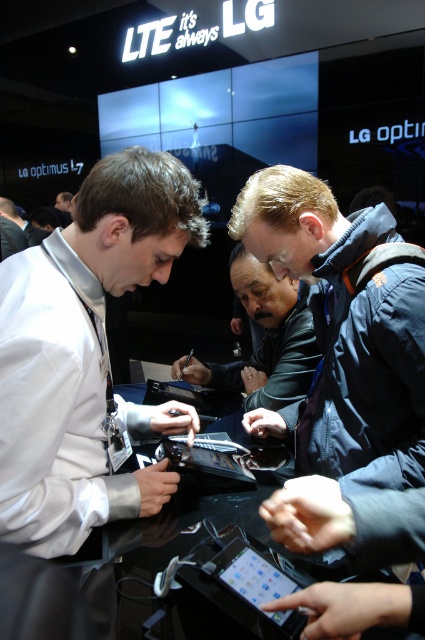
In the scene shown: You are an event photographer at the LG tech exhibition. You need to capture a photo of the white glossy shirt at left and the black leather jacket at center. Based on their sizes, which one should you focus on first to ensure proper framing?

The white glossy shirt at left has a lesser width compared to the black leather jacket at center, so you should focus on the black leather jacket at center first to ensure proper framing since it is wider and might require more attention in the composition.

You are standing at the origin point in the scene. There is a white glossy shirt at left located at point (82, 349). Can you tell me the coordinates of the white glossy shirt at left?

The white glossy shirt at left is located at point (82, 349).

You are at an event and want to describe the position of the black leather jacket at center and the metallic silver tablet at center to a friend. Which object is positioned to the right of the other?

The black leather jacket at center is to the right of the metallic silver tablet at center.